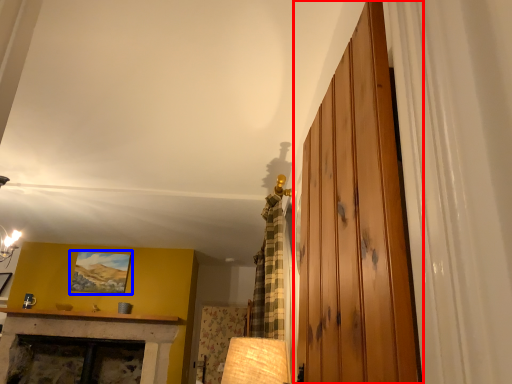
Question: Which point is closer to the camera, barn door (highlighted by a red box) or picture frame (highlighted by a blue box)?

Choices:
 (A) barn door
 (B) picture frame

Answer: (A)